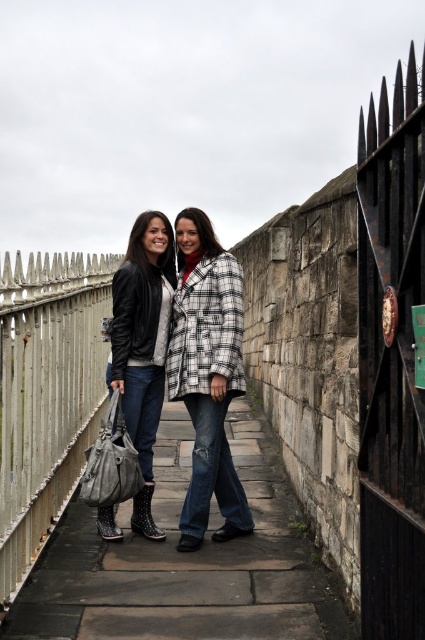
Please describe the position of the white checkered coat at center in the image using coordinates. The scene has two people on a stone pathway near a wall and fence. The coat belongs to one of them. Please provide the coordinates as a point in the format like point 0.5,0.5.

The white checkered coat at center is located at point [206,374].

You are taking a photo of two points on the stone pathway in the historic area. The first point is at coordinates point (161, 445) and the second is at point (167, 273). Which point is closer to your camera lens?

Point (161, 445) is further to the camera than point (167, 273), so the second point is closer to the camera lens.